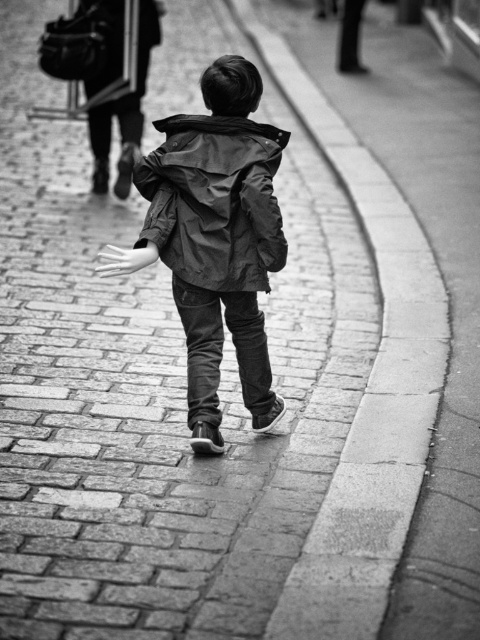
Question: Is smooth concrete curb at center thinner than dark green fabric jacket at center?

Choices:
 (A) yes
 (B) no

Answer: (B)

Question: Considering the relative positions of dark green fabric jacket at center and matte black trench coat at upper center in the image provided, where is dark green fabric jacket at center located with respect to matte black trench coat at upper center?

Choices:
 (A) right
 (B) left

Answer: (A)

Question: Is smooth concrete curb at center further to the viewer compared to matte black trench coat at upper center?

Choices:
 (A) no
 (B) yes

Answer: (A)

Question: Among these objects, which one is nearest to the camera?

Choices:
 (A) dark green fabric jacket at center
 (B) matte black trench coat at upper center

Answer: (A)

Question: Which object appears closest to the camera in this image?

Choices:
 (A) smooth concrete curb at center
 (B) matte black trench coat at upper center
 (C) dark green fabric jacket at center
 (D) matte black jacket at center

Answer: (A)

Question: Which point appears farthest from the camera in this image?

Choices:
 (A) (301, 582)
 (B) (131, 100)
 (C) (224, 154)
 (D) (224, 252)

Answer: (B)